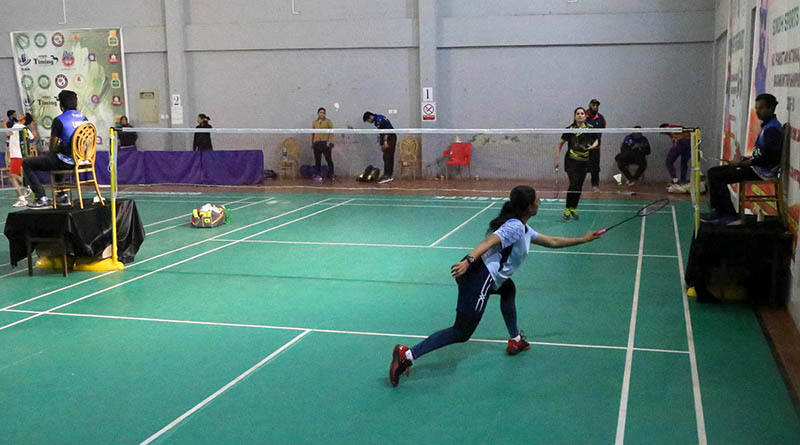
Where is `wall`? wall is located at coordinates (252, 74), (508, 86).